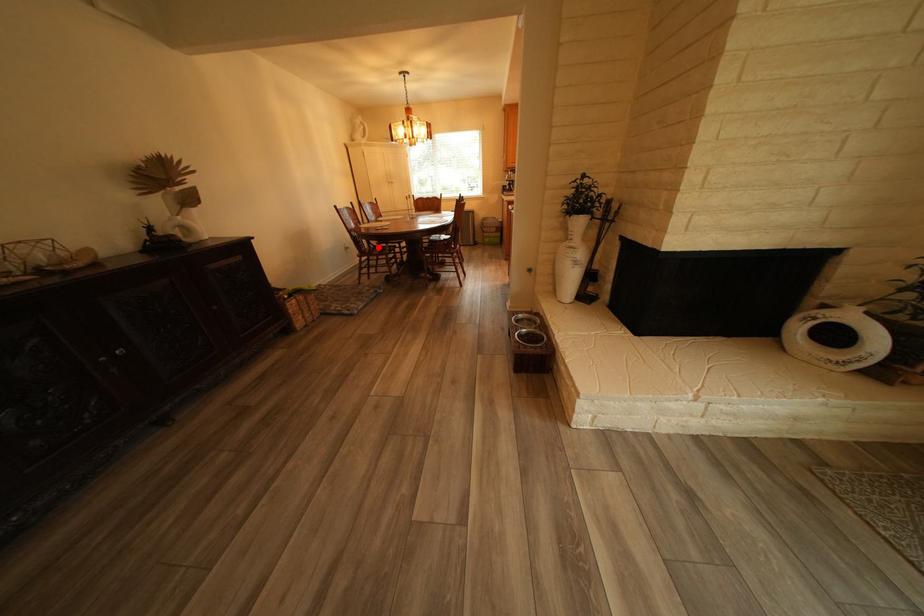
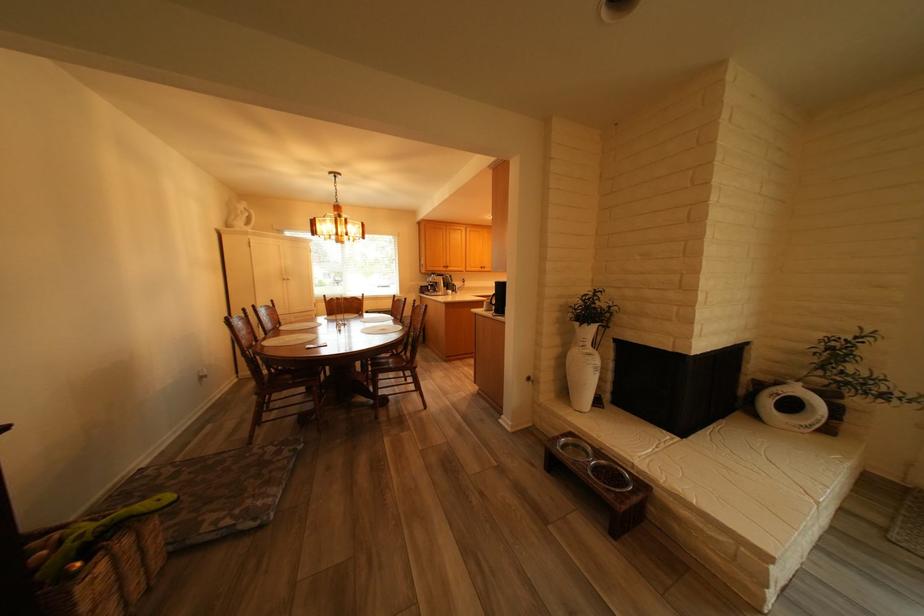
Find the pixel in the second image that matches the highlighted location in the first image.

(276, 374)